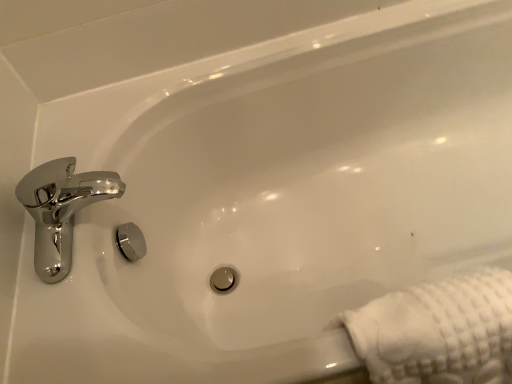
Question: Considering the positions of chrome/metallic faucet at upper left and white textured towel at lower right in the image, is chrome/metallic faucet at upper left wider or thinner than white textured towel at lower right?

Choices:
 (A) thin
 (B) wide

Answer: (B)

Question: Would you say chrome/metallic faucet at upper left is to the left or to the right of white textured towel at lower right in the picture?

Choices:
 (A) right
 (B) left

Answer: (B)

Question: From a real-world perspective, relative to white textured towel at lower right, is chrome/metallic faucet at upper left vertically above or below?

Choices:
 (A) above
 (B) below

Answer: (A)

Question: Would you say white textured towel at lower right is inside or outside chrome/metallic faucet at upper left?

Choices:
 (A) outside
 (B) inside

Answer: (A)

Question: Is point (429, 367) closer or farther from the camera than point (61, 215)?

Choices:
 (A) closer
 (B) farther

Answer: (A)

Question: From a real-world perspective, is white textured towel at lower right physically located above or below chrome/metallic faucet at upper left?

Choices:
 (A) above
 (B) below

Answer: (B)

Question: In terms of width, does white textured towel at lower right look wider or thinner when compared to chrome/metallic faucet at upper left?

Choices:
 (A) thin
 (B) wide

Answer: (A)